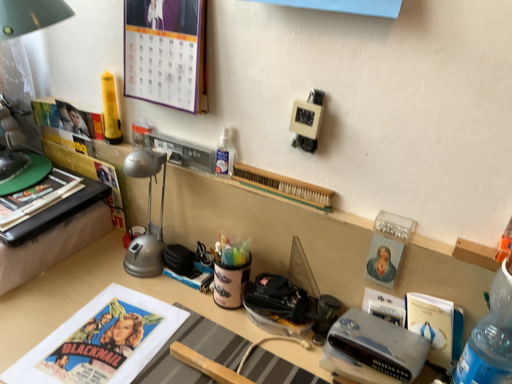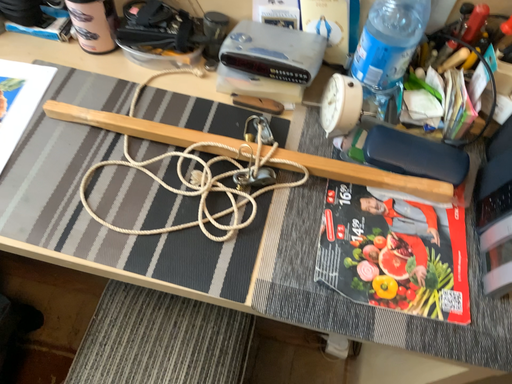
Question: Which way did the camera rotate in the video?

Choices:
 (A) rotated left
 (B) rotated right

Answer: (B)